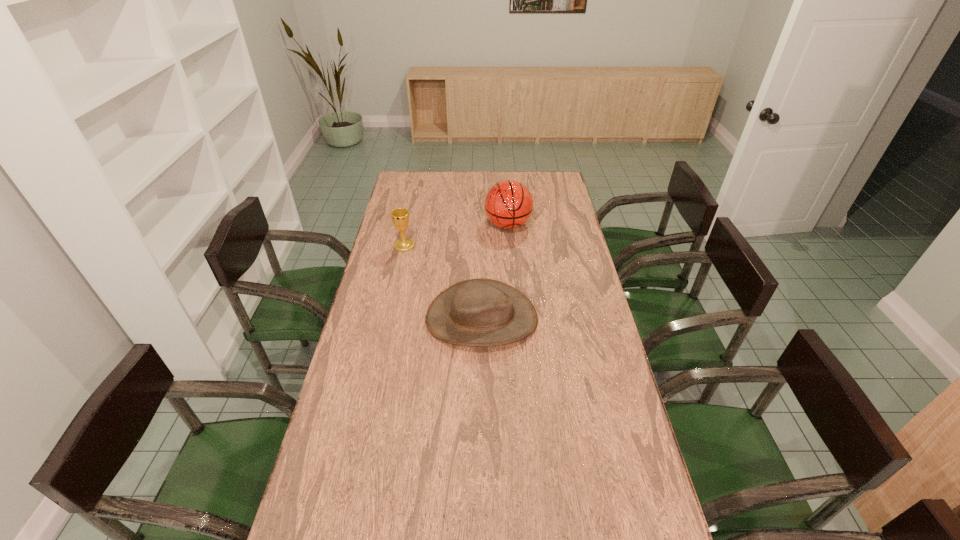
Image resolution: width=960 pixels, height=540 pixels. What are the coordinates of `free location at the far edge of the desktop` in the screenshot? It's located at (527, 187).

This screenshot has width=960, height=540. In the image, there is a desktop. Find the location of `free space at the left edge`. free space at the left edge is located at coordinates (328, 481).

The width and height of the screenshot is (960, 540). I want to click on blank space at the right edge, so click(606, 457).

Locate an element on the screen. vacant position at the far right corner of the desktop is located at coordinates (534, 193).

The width and height of the screenshot is (960, 540). Identify the location of free area in between the farthest object and the chalice. (456, 235).

Identify the location of blank region between the second shortest object and the farthest object. (456, 235).

Locate an element on the screen. The width and height of the screenshot is (960, 540). object that is the second closest to the tallest object is located at coordinates click(x=481, y=312).

The height and width of the screenshot is (540, 960). I want to click on the closest object to the nearest object, so click(400, 216).

Where is `free point that satisfies the following two spatial constraints: 1. on the front side of the shortest object; 2. on the left side of the leftmost object`? This screenshot has width=960, height=540. free point that satisfies the following two spatial constraints: 1. on the front side of the shortest object; 2. on the left side of the leftmost object is located at coordinates [x=389, y=318].